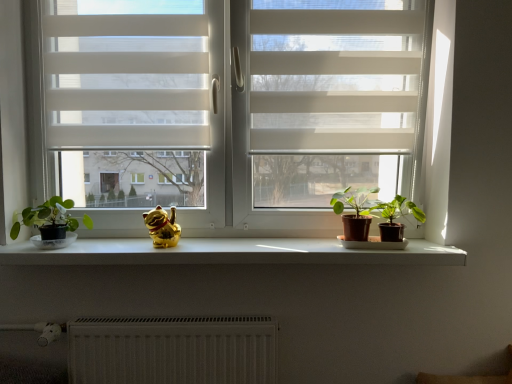
Find the location of a particular element. vacant area that lies between green matte plant at left, the first houseplant viewed from the left, and green matte houseplant at right, acting as the 1th houseplant starting from the right is located at coordinates coord(216,246).